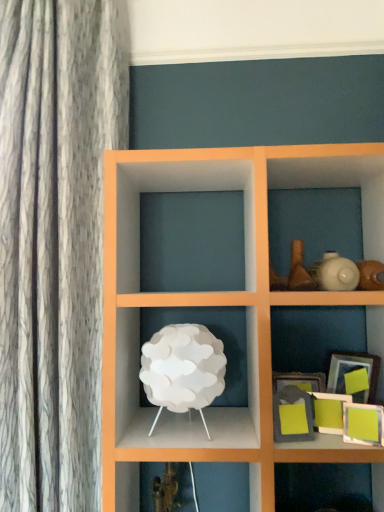
Question: Is point (294, 401) positioned closer to the camera than point (309, 382)?

Choices:
 (A) closer
 (B) farther

Answer: (A)

Question: Is matte gray picture frame at lower right, placed as the 2th picture frame when sorted from front to back, in front of or behind matte gray picture frame at lower right, the first picture frame viewed from the back, in the image?

Choices:
 (A) behind
 (B) front

Answer: (B)

Question: Considering the real-world distances, which object is closest to the matte green picture frame at lower right, marked as the third picture frame in a back-to-front arrangement?

Choices:
 (A) matte gray picture frame at lower right, the first picture frame viewed from the back
 (B) matte green picture frame at lower right, the 1th picture frame in the front-to-back sequence
 (C) white matte/porcelain table lamp at center
 (D) matte green picture frame at lower right, placed as the 4th picture frame when sorted from front to back
 (E) matte gray picture frame at lower right, placed as the 2th picture frame when sorted from front to back

Answer: (B)

Question: Estimate the real-world distances between objects in this image. Which object is closer to the white matte/porcelain table lamp at center?

Choices:
 (A) matte gray picture frame at lower right, which is the fourth picture frame from back to front
 (B) matte green picture frame at lower right, the 3th picture frame in the front-to-back sequence
 (C) matte green picture frame at lower right, placed as the fifth picture frame when sorted from back to front
 (D) matte green picture frame at lower right, placed as the 4th picture frame when sorted from front to back
 (E) matte gray picture frame at lower right, the first picture frame viewed from the back

Answer: (A)